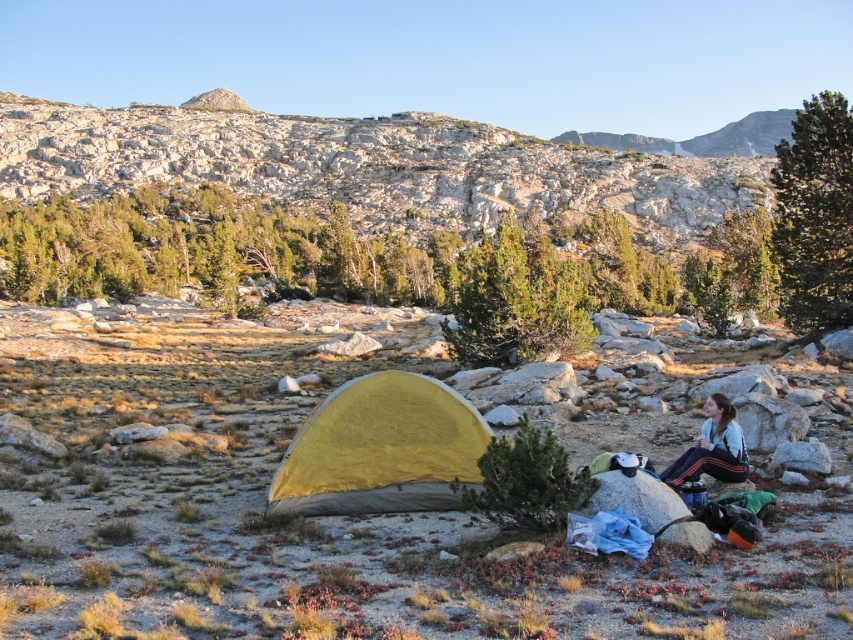
Question: Which point appears farthest from the camera in this image?

Choices:
 (A) (735, 429)
 (B) (433, 448)

Answer: (A)

Question: Is yellow fabric tent at lower center wider than white fleece jacket at lower right?

Choices:
 (A) yes
 (B) no

Answer: (A)

Question: Does yellow fabric tent at lower center have a smaller size compared to white fleece jacket at lower right?

Choices:
 (A) no
 (B) yes

Answer: (A)

Question: Is yellow fabric tent at lower center bigger than white fleece jacket at lower right?

Choices:
 (A) no
 (B) yes

Answer: (B)